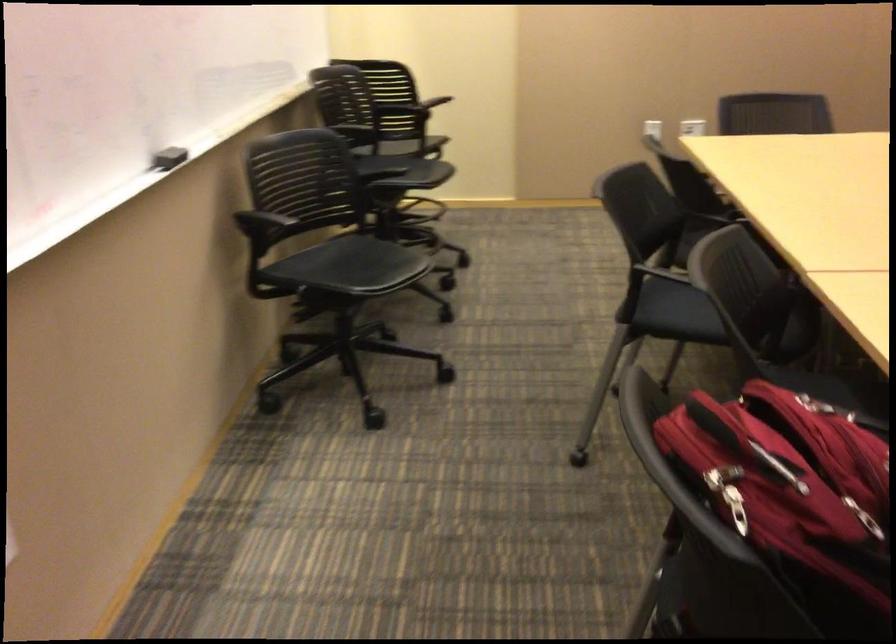
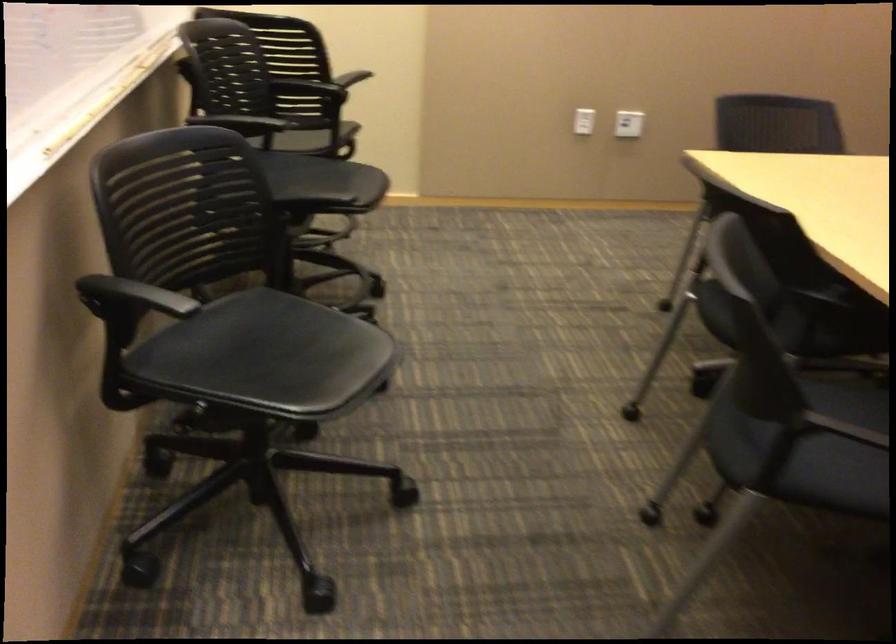
What movement of the cameraman would produce the second image?

The movement direction of the cameraman is left, forward.